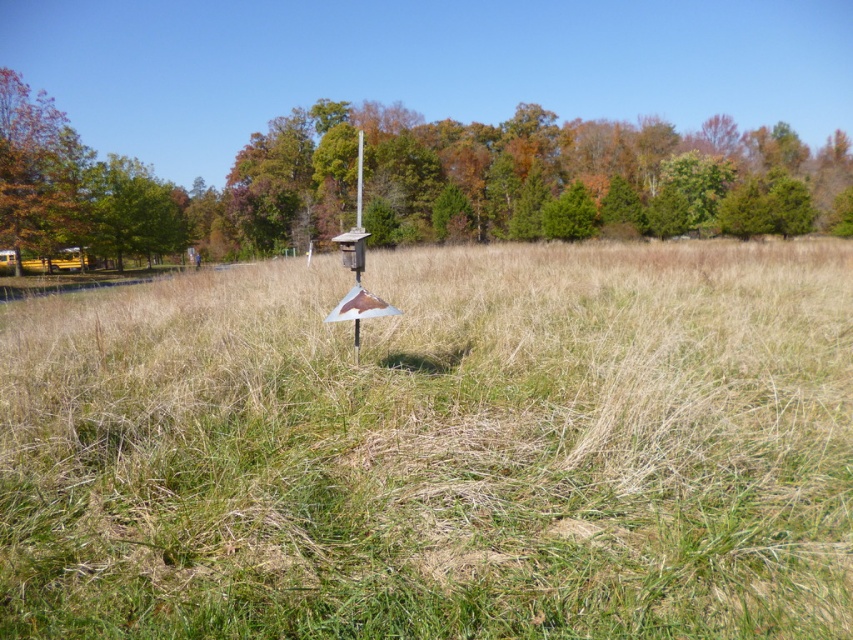
You are standing in the open grassy field and want to take a photo of both the metallic silver sign at center and the green matte tree at upper center. Which object should you focus on first to ensure both are in sharp focus?

The metallic silver sign at center is closer to the viewer than the green matte tree at upper center, so focus on the metallic silver sign at center first to ensure both are in sharp focus.

You are standing in the open grassy field and see two points marked in the image. Which point is closer to you, point (306,339) or point (395,172)?

Point (306,339) is in front of point (395,172), so it is closer to you.